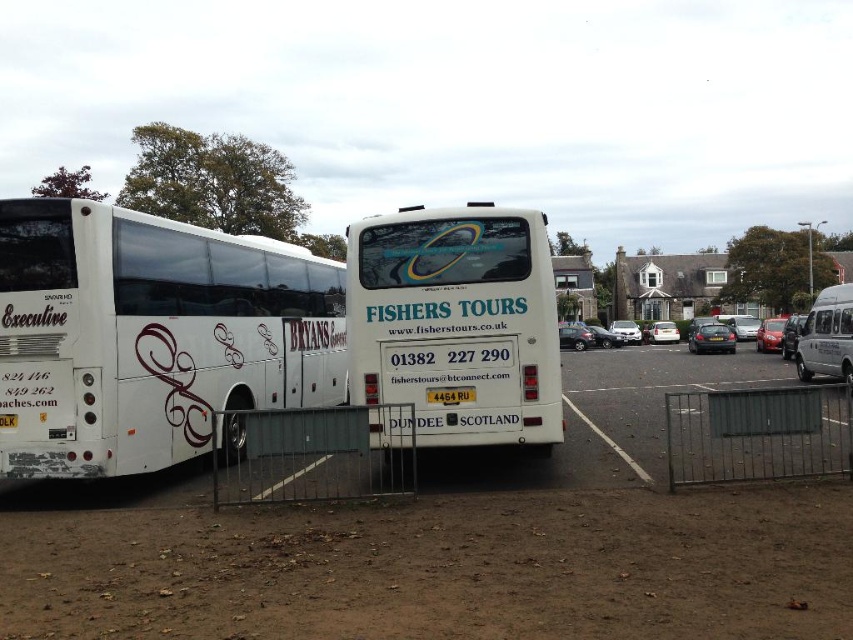
Question: Is shiny black sedan at center further to the viewer compared to yellow matte license plate at center?

Choices:
 (A) no
 (B) yes

Answer: (B)

Question: Observing the image, what is the correct spatial positioning of white matte coach at center in reference to metallic silver sedan at center?

Choices:
 (A) above
 (B) below

Answer: (A)

Question: Which point is farther to the camera?

Choices:
 (A) shiny black sedan at center
 (B) metallic silver sedan at center

Answer: (B)

Question: Which object is the closest to the metallic silver car at center?

Choices:
 (A) shiny black sedan at center
 (B) silver metallic sedan at center
 (C) white matte bus at center

Answer: (B)

Question: Does shiny black sedan at center appear over white metallic sedan at center?

Choices:
 (A) yes
 (B) no

Answer: (B)

Question: Estimate the real-world distances between objects in this image. Which object is farther from the metallic silver car at right?

Choices:
 (A) white metallic sedan at center
 (B) silver metallic sedan at center
 (C) metallic silver sedan at center

Answer: (A)